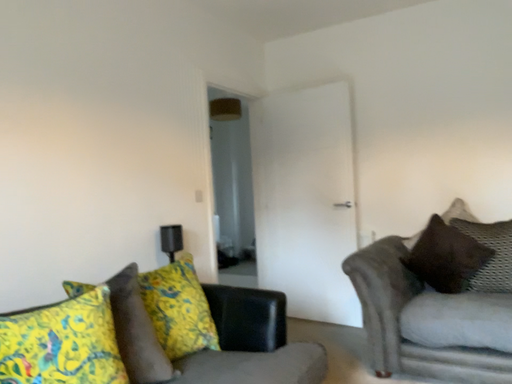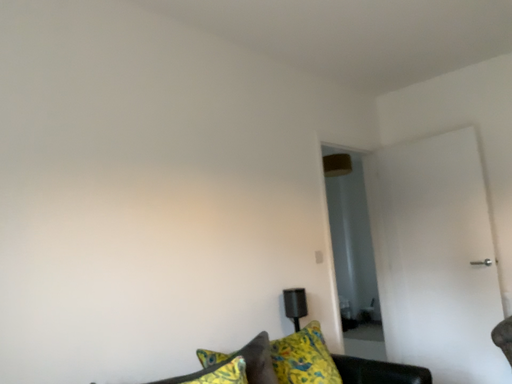
Question: How did the camera likely rotate when shooting the video?

Choices:
 (A) rotated upward
 (B) rotated downward

Answer: (A)